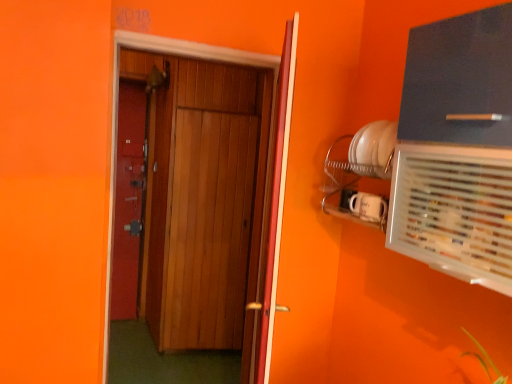
Question: Does clear plastic air conditioning at upper right have a larger size compared to wooden door at center, the 1th door viewed from the right?

Choices:
 (A) yes
 (B) no

Answer: (B)

Question: From a real-world perspective, is clear plastic air conditioning at upper right located beneath wooden door at center, the 1th door viewed from the right?

Choices:
 (A) yes
 (B) no

Answer: (B)

Question: Is clear plastic air conditioning at upper right taller than wooden door at center, the 1th door viewed from the right?

Choices:
 (A) no
 (B) yes

Answer: (A)

Question: From the image's perspective, is clear plastic air conditioning at upper right under wooden door at center, placed as the second door when sorted from left to right?

Choices:
 (A) yes
 (B) no

Answer: (B)

Question: Would you say wooden door at center, the 1th door viewed from the right, is part of clear plastic air conditioning at upper right's contents?

Choices:
 (A) yes
 (B) no

Answer: (B)

Question: Looking at the image, does clear plastic air conditioning at upper right seem bigger or smaller compared to wooden door at center, placed as the second door when sorted from left to right?

Choices:
 (A) small
 (B) big

Answer: (A)

Question: Does point (417, 150) appear closer or farther from the camera than point (269, 322)?

Choices:
 (A) farther
 (B) closer

Answer: (B)

Question: From the image's perspective, is clear plastic air conditioning at upper right positioned above or below wooden door at center, placed as the second door when sorted from left to right?

Choices:
 (A) below
 (B) above

Answer: (B)

Question: In the image, is clear plastic air conditioning at upper right positioned in front of or behind wooden door at center, placed as the second door when sorted from left to right?

Choices:
 (A) behind
 (B) front

Answer: (B)

Question: Is point (186, 288) positioned closer to the camera than point (414, 211)?

Choices:
 (A) farther
 (B) closer

Answer: (A)

Question: In terms of width, does wooden door at center, marked as the 2th door in a right-to-left arrangement, look wider or thinner when compared to clear plastic air conditioning at upper right?

Choices:
 (A) thin
 (B) wide

Answer: (A)

Question: Would you say wooden door at center, marked as the 2th door in a right-to-left arrangement, is inside or outside clear plastic air conditioning at upper right?

Choices:
 (A) outside
 (B) inside

Answer: (A)

Question: Considering the positions of wooden door at center, marked as the 2th door in a right-to-left arrangement, and clear plastic air conditioning at upper right in the image, is wooden door at center, marked as the 2th door in a right-to-left arrangement, taller or shorter than clear plastic air conditioning at upper right?

Choices:
 (A) short
 (B) tall

Answer: (B)

Question: From the image's perspective, is wooden door at center, the 1th door viewed from the left, located above or below matte black cabinet at upper right?

Choices:
 (A) above
 (B) below

Answer: (B)

Question: Is point (242, 97) positioned closer to the camera than point (470, 79)?

Choices:
 (A) farther
 (B) closer

Answer: (A)